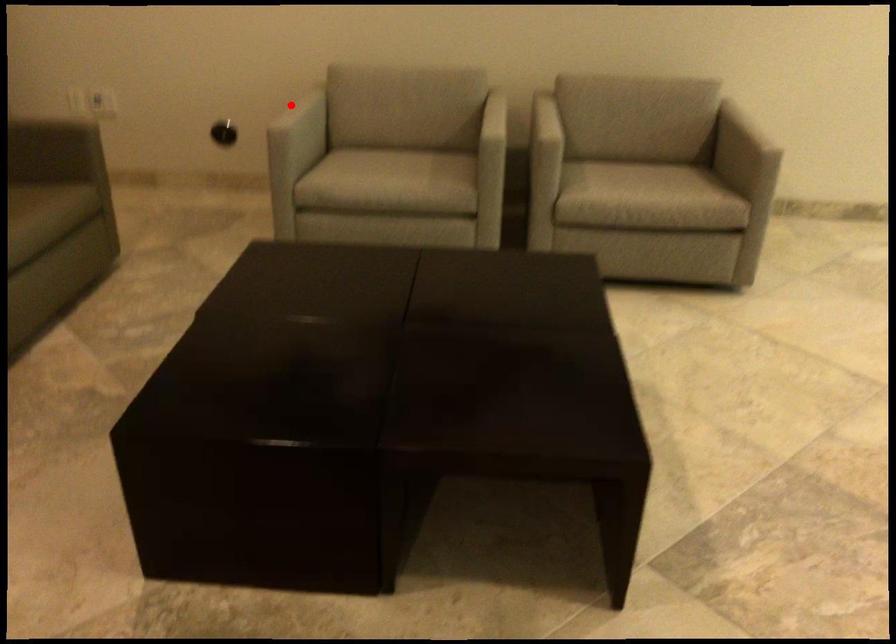
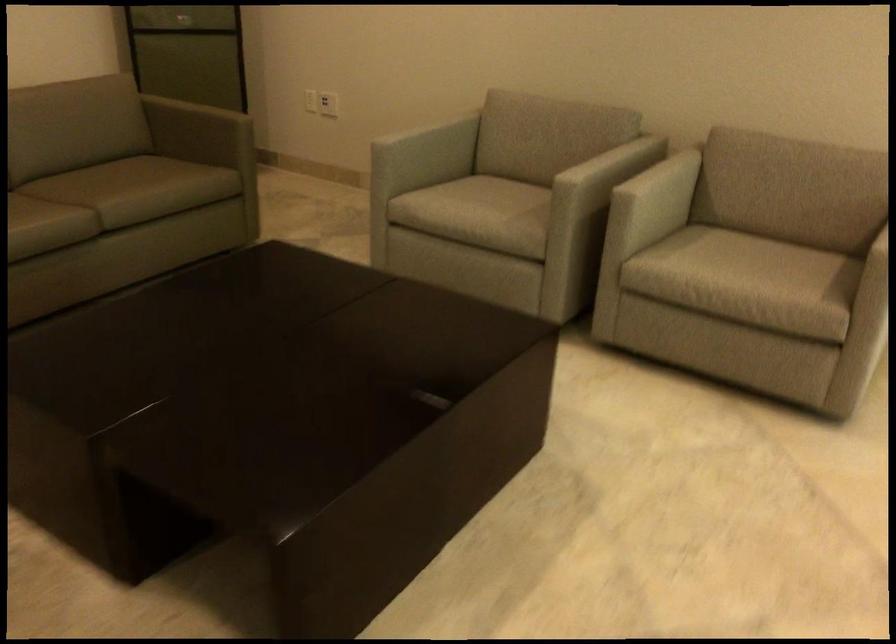
In the second image, find the point that corresponds to the highlighted location in the first image.

(423, 127)